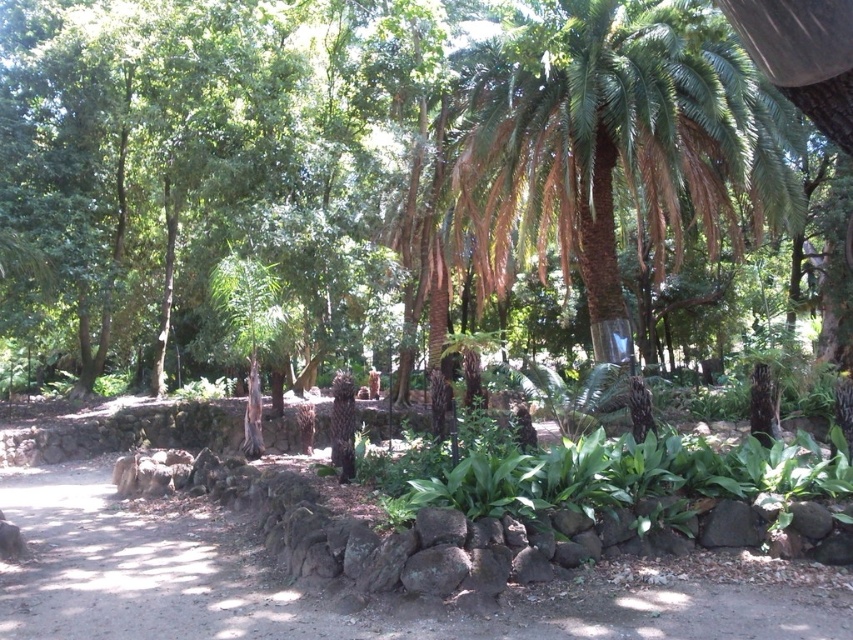
Question: Does green leafy palm at upper right appear over dirt path at center?

Choices:
 (A) yes
 (B) no

Answer: (A)

Question: Which of the following is the closest to the observer?

Choices:
 (A) coord(781,116)
 (B) coord(149,573)

Answer: (B)

Question: Can you confirm if green leafy palm at upper right is wider than dirt path at center?

Choices:
 (A) yes
 (B) no

Answer: (B)

Question: From the image, what is the correct spatial relationship of green leafy palm at upper right in relation to dirt path at center?

Choices:
 (A) right
 (B) left

Answer: (A)

Question: Which point is closer to the camera?

Choices:
 (A) (67, 616)
 (B) (589, 102)

Answer: (A)